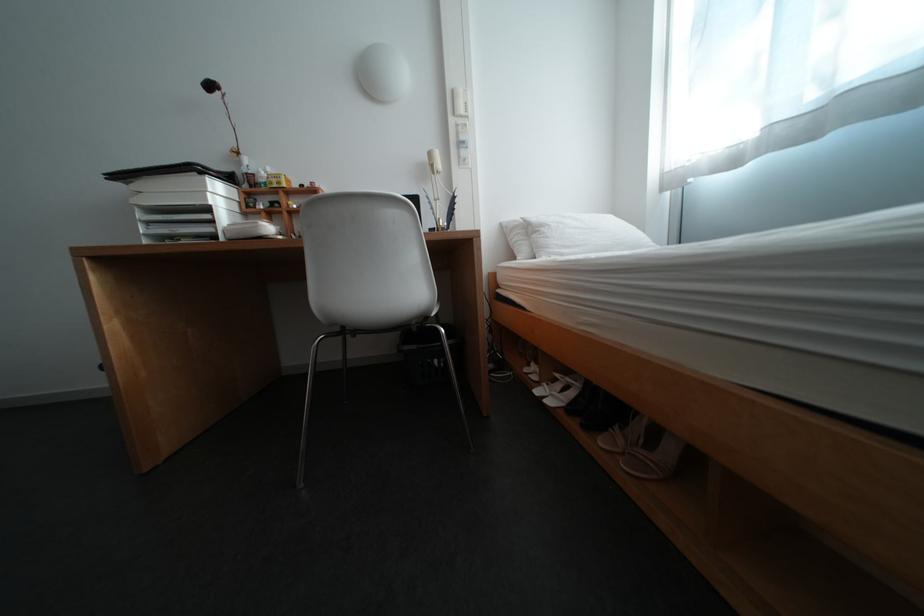
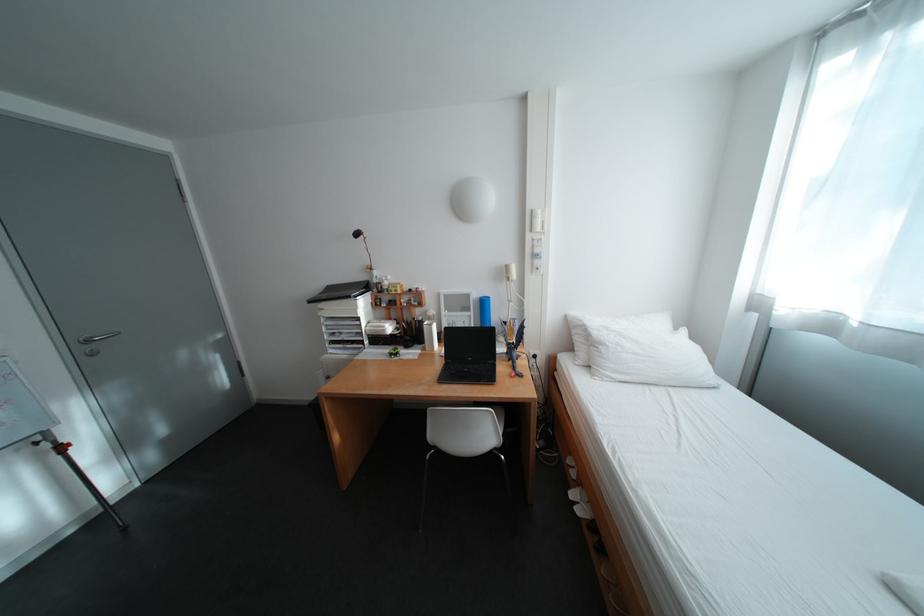
Where in the second image is the point corresponding to [466,92] from the first image?

(544, 213)